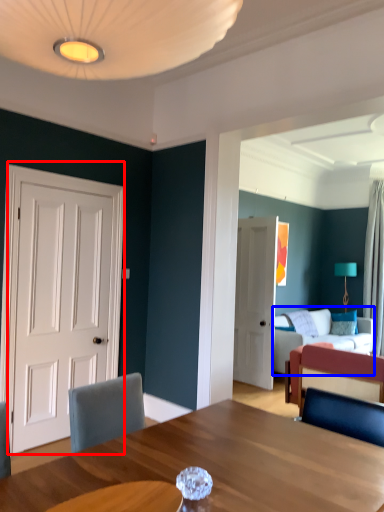
Question: Among these objects, which one is nearest to the camera, door (highlighted by a red box) or studio couch (highlighted by a blue box)?

Choices:
 (A) door
 (B) studio couch

Answer: (A)